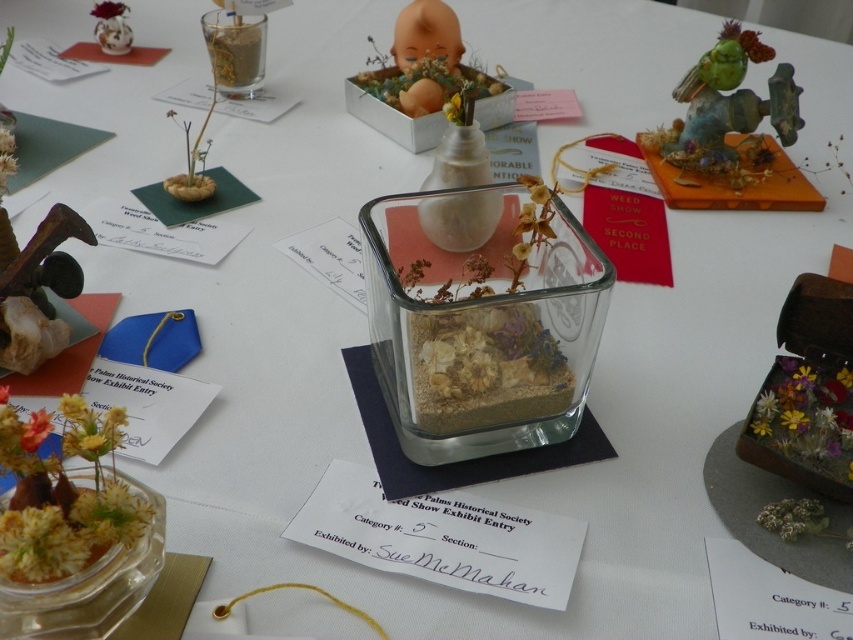
Is matte orange baby at center thinner than matte white figurine at upper left?

In fact, matte orange baby at center might be wider than matte white figurine at upper left.

Who is taller, matte orange baby at center or matte white figurine at upper left?

With more height is matte orange baby at center.

Where is `matte orange baby at center`? Image resolution: width=853 pixels, height=640 pixels. matte orange baby at center is located at coordinates (424, 61).

Is point (715, 124) more distant than point (125, 20)?

No.

Is point (727, 118) positioned before point (114, 3)?

Yes, point (727, 118) is closer to viewer.

Describe the element at coordinates (727, 106) in the screenshot. Image resolution: width=853 pixels, height=640 pixels. I see `green matte bird at upper right` at that location.

Locate an element on the screen. green matte bird at upper right is located at coordinates (727, 106).

Which is below, green matte bird at upper right or matte orange baby at center?

Positioned lower is green matte bird at upper right.

Can you confirm if green matte bird at upper right is positioned to the left of matte orange baby at center?

Incorrect, green matte bird at upper right is not on the left side of matte orange baby at center.

What do you see at coordinates (727, 106) in the screenshot?
I see `green matte bird at upper right` at bounding box center [727, 106].

Locate an element on the screen. This screenshot has width=853, height=640. green matte bird at upper right is located at coordinates (727, 106).